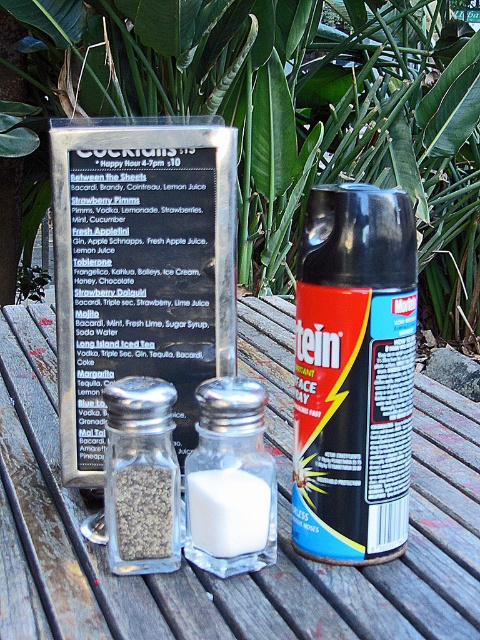
You are a customer at an outdoor dining table. You want to place a small herb sprig between the green leafy plant at center and the clear glass salt shaker at center. Which object should you use as a reference point to ensure the sprig is placed closer to the taller object?

The green leafy plant at center is taller than the clear glass salt shaker at center, so you should use the green leafy plant at center as the reference point to place the herb sprig closer to it.

You are a customer at this outdoor dining area and want to grab a condiment quickly. You see the black matte spray can at center and the white glass salt shaker at center. Which one is taller?

The black matte spray can at center is much taller than the white glass salt shaker at center.

Consider the image. You are setting up a picnic and need to place both the black matte spray can at center and the white glass salt shaker at center on the table. Given that the table has limited space, which item should you place first to ensure both fit comfortably?

The black matte spray can at center is larger in size than the white glass salt shaker at center, so you should place the larger black matte spray can at center first to ensure both items fit comfortably on the table.